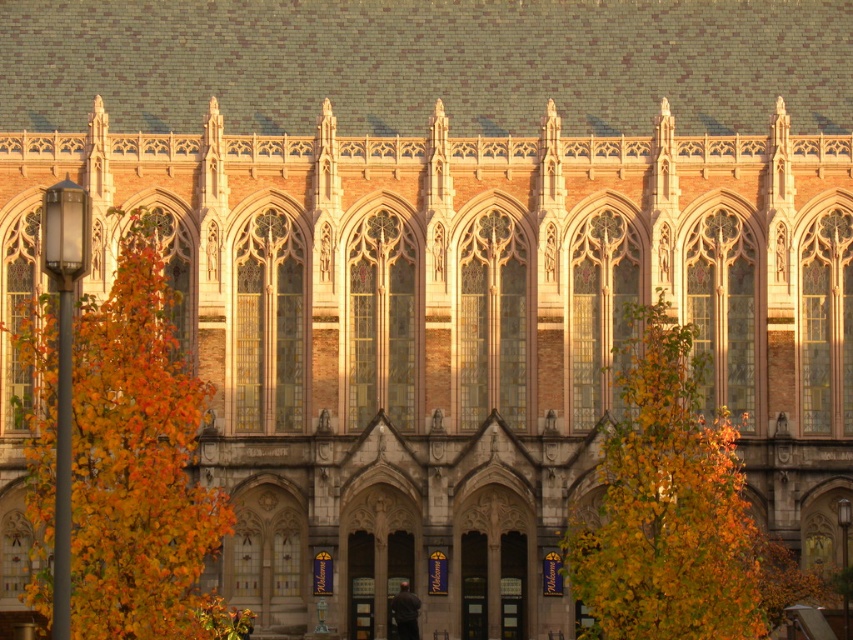
You are standing in front of the historic building and want to determine which of the two points, point (47,467) or point (605,429), is closer to you. Based on the structure of the building, which point would you say is nearer?

A: Point (47,467) is closer to the viewer than point (605,429).